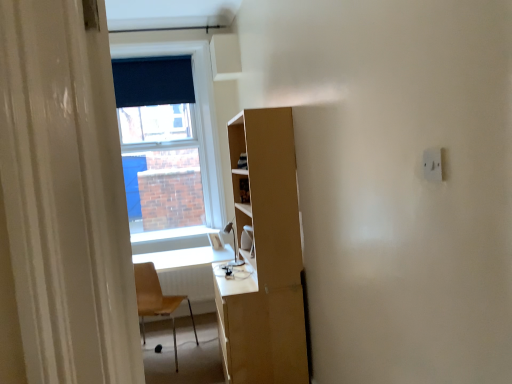
Question: Is light brown plastic chair at lower left completely or partially outside of white glossy computer desk at center?

Choices:
 (A) no
 (B) yes

Answer: (A)

Question: Can you confirm if light brown plastic chair at lower left is wider than white glossy computer desk at center?

Choices:
 (A) yes
 (B) no

Answer: (B)

Question: Can you confirm if light brown plastic chair at lower left is thinner than white glossy computer desk at center?

Choices:
 (A) yes
 (B) no

Answer: (A)

Question: Can you confirm if light brown plastic chair at lower left is shorter than white glossy computer desk at center?

Choices:
 (A) no
 (B) yes

Answer: (A)

Question: Considering the relative positions of light brown plastic chair at lower left and white glossy computer desk at center in the image provided, is light brown plastic chair at lower left to the right of white glossy computer desk at center from the viewer's perspective?

Choices:
 (A) no
 (B) yes

Answer: (A)

Question: Is light brown plastic chair at lower left smaller than white glossy computer desk at center?

Choices:
 (A) yes
 (B) no

Answer: (A)

Question: Considering the relative sizes of white plastic electric outlet at upper right and white glossy computer desk at center in the image provided, is white plastic electric outlet at upper right bigger than white glossy computer desk at center?

Choices:
 (A) yes
 (B) no

Answer: (B)

Question: Can you confirm if white plastic electric outlet at upper right is thinner than white glossy computer desk at center?

Choices:
 (A) yes
 (B) no

Answer: (A)

Question: Considering the relative sizes of white plastic electric outlet at upper right and white glossy computer desk at center in the image provided, is white plastic electric outlet at upper right taller than white glossy computer desk at center?

Choices:
 (A) no
 (B) yes

Answer: (A)

Question: From the image's perspective, is white plastic electric outlet at upper right on top of white glossy computer desk at center?

Choices:
 (A) no
 (B) yes

Answer: (B)

Question: Is white plastic electric outlet at upper right located outside white glossy computer desk at center?

Choices:
 (A) no
 (B) yes

Answer: (B)

Question: Is white plastic electric outlet at upper right to the left of white glossy computer desk at center from the viewer's perspective?

Choices:
 (A) yes
 (B) no

Answer: (B)

Question: Is white glossy computer desk at center at the right side of white glossy window sill at center?

Choices:
 (A) yes
 (B) no

Answer: (A)